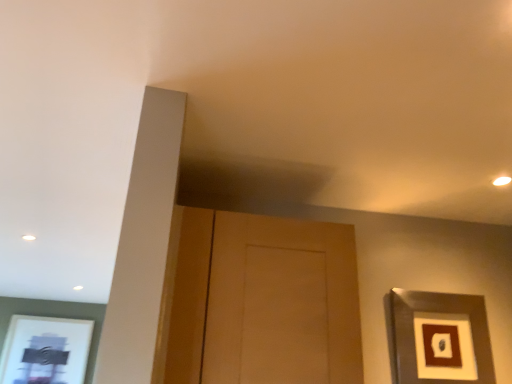
Question: Is wooden door at center completely or partially outside of metallic silver picture frame at upper right?

Choices:
 (A) no
 (B) yes

Answer: (B)

Question: Is the surface of wooden door at center in direct contact with metallic silver picture frame at upper right?

Choices:
 (A) yes
 (B) no

Answer: (B)

Question: Is wooden door at center turned away from metallic silver picture frame at upper right?

Choices:
 (A) yes
 (B) no

Answer: (B)

Question: Does wooden door at center come in front of metallic silver picture frame at upper right?

Choices:
 (A) yes
 (B) no

Answer: (A)

Question: Considering the relative sizes of wooden door at center and metallic silver picture frame at upper right in the image provided, is wooden door at center shorter than metallic silver picture frame at upper right?

Choices:
 (A) no
 (B) yes

Answer: (A)

Question: Is wooden door at center taller than metallic silver picture frame at upper right?

Choices:
 (A) yes
 (B) no

Answer: (A)

Question: Can you confirm if metallic silver picture frame at upper right is smaller than wooden door at center?

Choices:
 (A) yes
 (B) no

Answer: (A)

Question: Is the depth of metallic silver picture frame at upper right greater than that of wooden door at center?

Choices:
 (A) no
 (B) yes

Answer: (B)

Question: From a real-world perspective, is metallic silver picture frame at upper right beneath wooden door at center?

Choices:
 (A) yes
 (B) no

Answer: (A)

Question: Does metallic silver picture frame at upper right have a lesser width compared to wooden door at center?

Choices:
 (A) yes
 (B) no

Answer: (A)

Question: Is metallic silver picture frame at upper right bigger than wooden door at center?

Choices:
 (A) yes
 (B) no

Answer: (B)

Question: Does metallic silver picture frame at upper right appear on the right side of wooden door at center?

Choices:
 (A) yes
 (B) no

Answer: (A)

Question: Is wooden door at center in front of or behind metallic silver picture frame at upper right in the image?

Choices:
 (A) front
 (B) behind

Answer: (A)